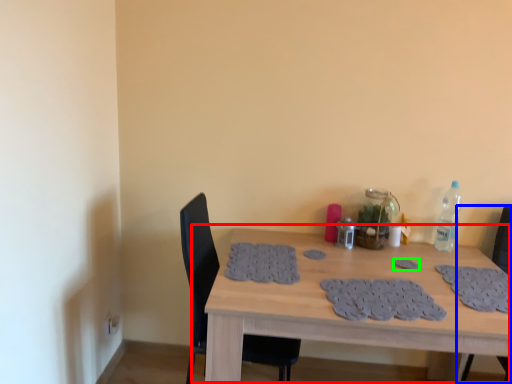
Question: Which object is the closest to the table (highlighted by a red box)? Choose among these: chair (highlighted by a blue box) or footprint (highlighted by a green box).

Choices:
 (A) chair
 (B) footprint

Answer: (B)